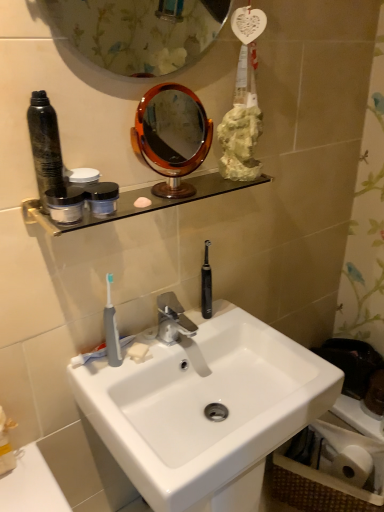
What are the coordinates of `vacant point to the right of silver metallic faucet at center` in the screenshot? It's located at (251, 329).